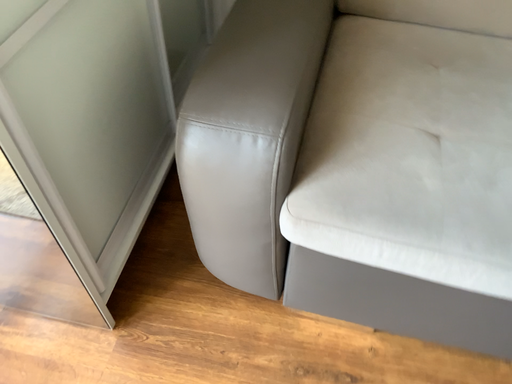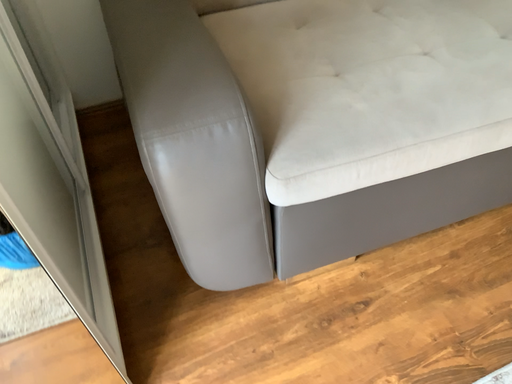
Question: Which way did the camera rotate in the video?

Choices:
 (A) rotated upward
 (B) rotated downward

Answer: (A)